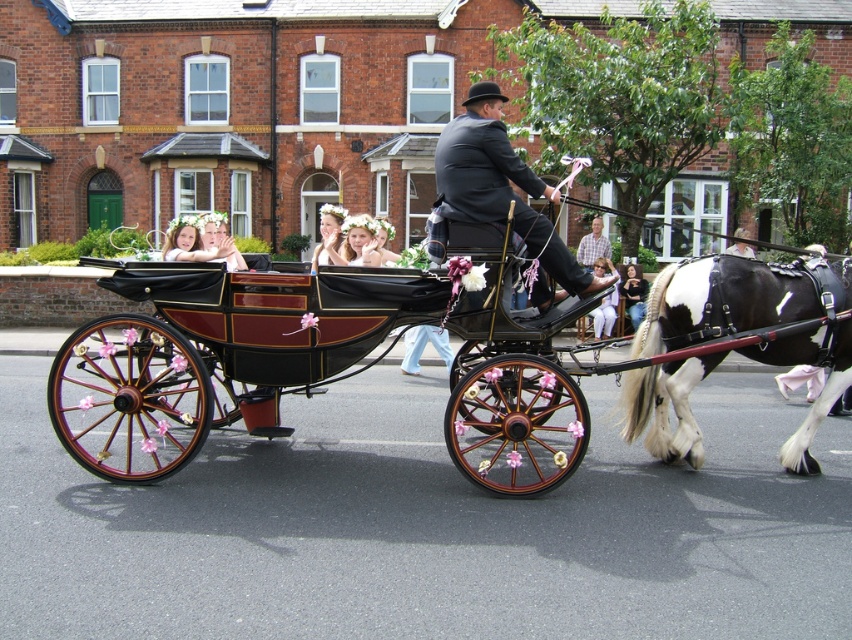
Does black and white speckled horse at right have a lesser height compared to matte black dress at center?

No.

Is black and white speckled horse at right positioned in front of matte black dress at center?

Yes, it is in front of matte black dress at center.

The image size is (852, 640). What are the coordinates of `black and white speckled horse at right` in the screenshot? It's located at (720, 301).

Where is `black and white speckled horse at right`? This screenshot has height=640, width=852. black and white speckled horse at right is located at coordinates (720, 301).

Who is more forward, (458, 218) or (629, 284)?

Point (458, 218) is in front.

Based on the photo, does shiny black coach at center have a smaller size compared to matte black dress at center?

Actually, shiny black coach at center might be larger than matte black dress at center.

Where is `shiny black coach at center`? shiny black coach at center is located at coordinates (501, 189).

What are the coordinates of `black and white speckled horse at right` in the screenshot? It's located at (720, 301).

Who is taller, black and white speckled horse at right or plaid shirt at center?

black and white speckled horse at right

Identify the location of black and white speckled horse at right. (720, 301).

In order to click on black and white speckled horse at right in this screenshot , I will do `click(720, 301)`.